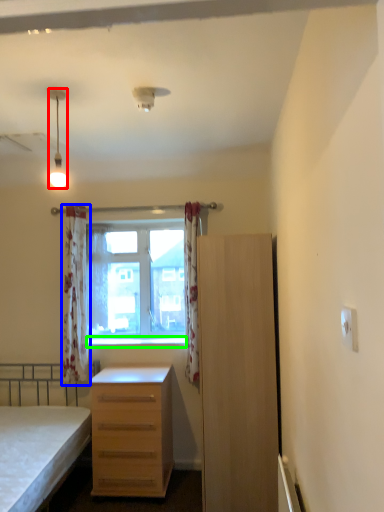
Question: Considering the real-world distances, which object is closest to lamp (highlighted by a red box)? curtain (highlighted by a blue box) or window sill (highlighted by a green box).

Choices:
 (A) curtain
 (B) window sill

Answer: (A)